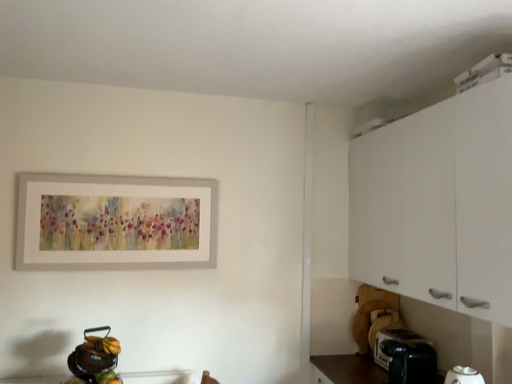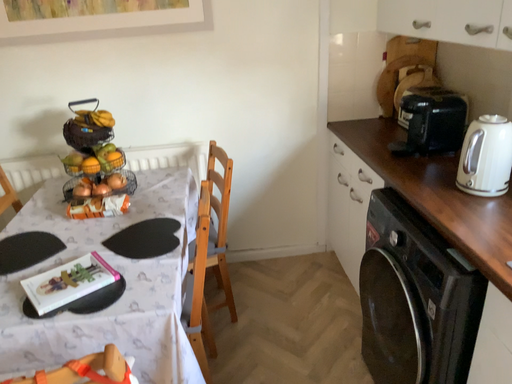
Question: Which way did the camera rotate in the video?

Choices:
 (A) rotated upward
 (B) rotated downward

Answer: (B)